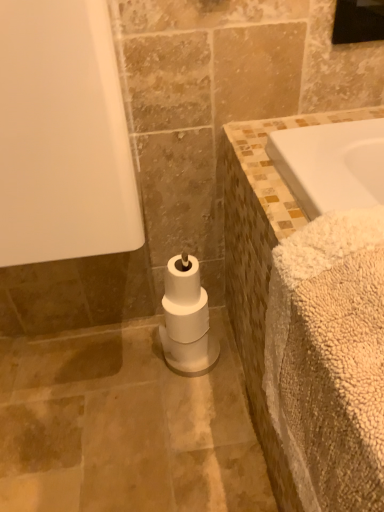
Question: Considering the relative sizes of white matte toilet paper at center and black glass mirror at upper right in the image provided, is white matte toilet paper at center shorter than black glass mirror at upper right?

Choices:
 (A) no
 (B) yes

Answer: (A)

Question: From a real-world perspective, is white matte toilet paper at center below black glass mirror at upper right?

Choices:
 (A) no
 (B) yes

Answer: (B)

Question: Is white matte toilet paper at center in contact with black glass mirror at upper right?

Choices:
 (A) yes
 (B) no

Answer: (B)

Question: Is white matte toilet paper at center further to the viewer compared to black glass mirror at upper right?

Choices:
 (A) no
 (B) yes

Answer: (B)

Question: Is white matte toilet paper at center at the left side of black glass mirror at upper right?

Choices:
 (A) no
 (B) yes

Answer: (B)

Question: Can you confirm if white matte toilet paper at center is bigger than black glass mirror at upper right?

Choices:
 (A) yes
 (B) no

Answer: (A)

Question: Considering the relative sizes of black glass mirror at upper right and beige fluffy bath towel at right in the image provided, is black glass mirror at upper right thinner than beige fluffy bath towel at right?

Choices:
 (A) yes
 (B) no

Answer: (A)

Question: Is black glass mirror at upper right positioned with its back to beige fluffy bath towel at right?

Choices:
 (A) yes
 (B) no

Answer: (B)

Question: Is beige fluffy bath towel at right completely or partially inside black glass mirror at upper right?

Choices:
 (A) yes
 (B) no

Answer: (B)

Question: Is black glass mirror at upper right oriented towards beige fluffy bath towel at right?

Choices:
 (A) yes
 (B) no

Answer: (B)

Question: Is black glass mirror at upper right bigger than beige fluffy bath towel at right?

Choices:
 (A) no
 (B) yes

Answer: (A)

Question: Is black glass mirror at upper right not near beige fluffy bath towel at right?

Choices:
 (A) no
 (B) yes

Answer: (A)

Question: From a real-world perspective, is black glass mirror at upper right on top of white matte toilet paper at center?

Choices:
 (A) no
 (B) yes

Answer: (B)